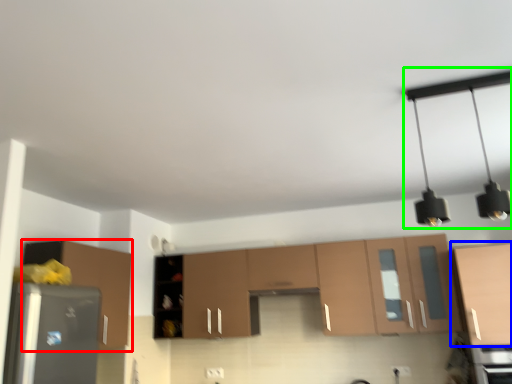
Question: Considering the real-world distances, which object is closest to cabinetry (highlighted by a red box)? cabinetry (highlighted by a blue box) or light fixture (highlighted by a green box).

Choices:
 (A) cabinetry
 (B) light fixture

Answer: (A)